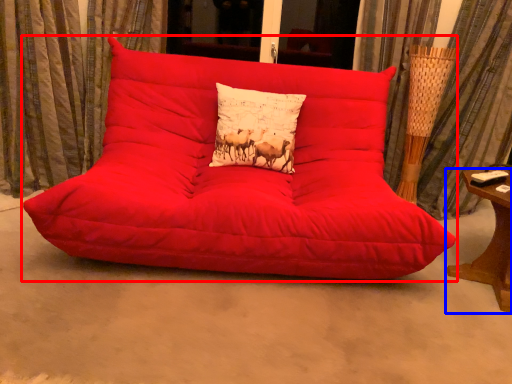
Question: Which object is closer to the camera taking this photo, studio couch (highlighted by a red box) or table (highlighted by a blue box)?

Choices:
 (A) studio couch
 (B) table

Answer: (A)